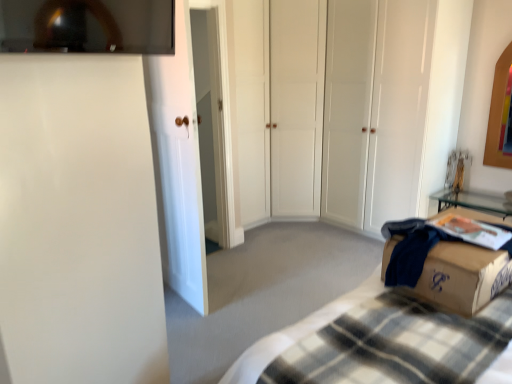
Question: From the image's perspective, is white matte closet doors at center, which is the 2th glass door from left to right, above or below plaid fabric bed at lower right?

Choices:
 (A) above
 (B) below

Answer: (A)

Question: Considering the positions of white matte closet doors at center, which is the 2th glass door from left to right, and plaid fabric bed at lower right in the image, is white matte closet doors at center, which is the 2th glass door from left to right, taller or shorter than plaid fabric bed at lower right?

Choices:
 (A) short
 (B) tall

Answer: (B)

Question: Considering the real-world distances, which object is closest to the brown cardboard box at lower right?

Choices:
 (A) wooden picture frame at upper right
 (B) white glossy door at left, the second glass door positioned from the back
 (C) plaid fabric bed at lower right
 (D) transparent glass tv at upper center
 (E) white matte closet doors at center, which is the second glass door in front-to-back order

Answer: (C)

Question: Which object is positioned closest to the transparent glass tv at upper center?

Choices:
 (A) brown cardboard box at lower right
 (B) white glossy door at left, the second glass door positioned from the back
 (C) white matte closet doors at center, the 1th glass door positioned from the back
 (D) wooden picture frame at upper right
 (E) plaid fabric bed at lower right

Answer: (E)